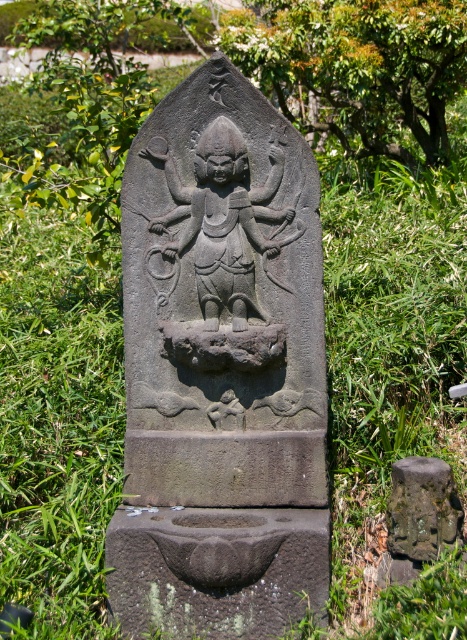
Is gray stone statue at center shorter than black stone deity at center?

No.

Can you confirm if gray stone statue at center is wider than black stone deity at center?

Correct, the width of gray stone statue at center exceeds that of black stone deity at center.

Does point (309, 547) lie behind point (227, 164)?

No, (309, 547) is closer to viewer.

I want to click on gray stone statue at center, so click(220, 369).